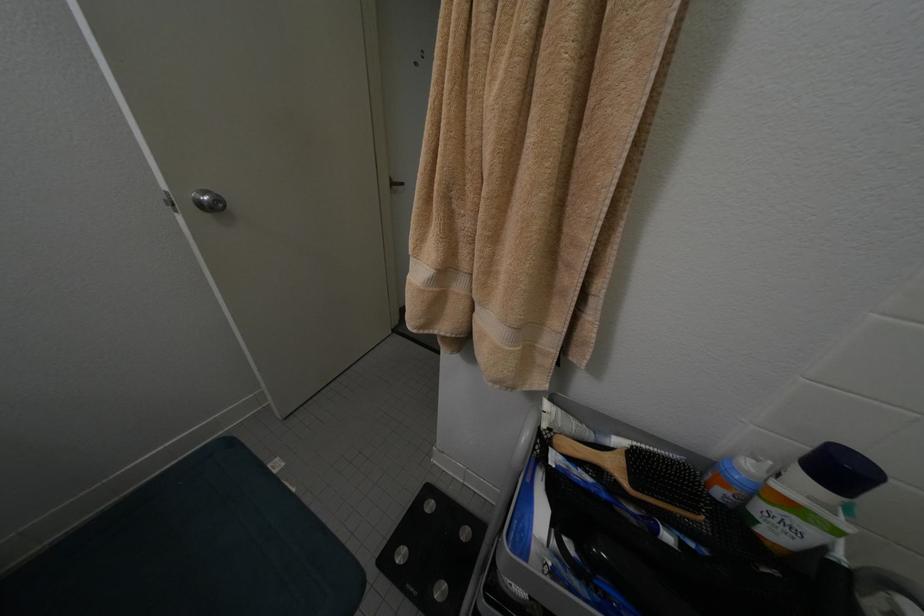
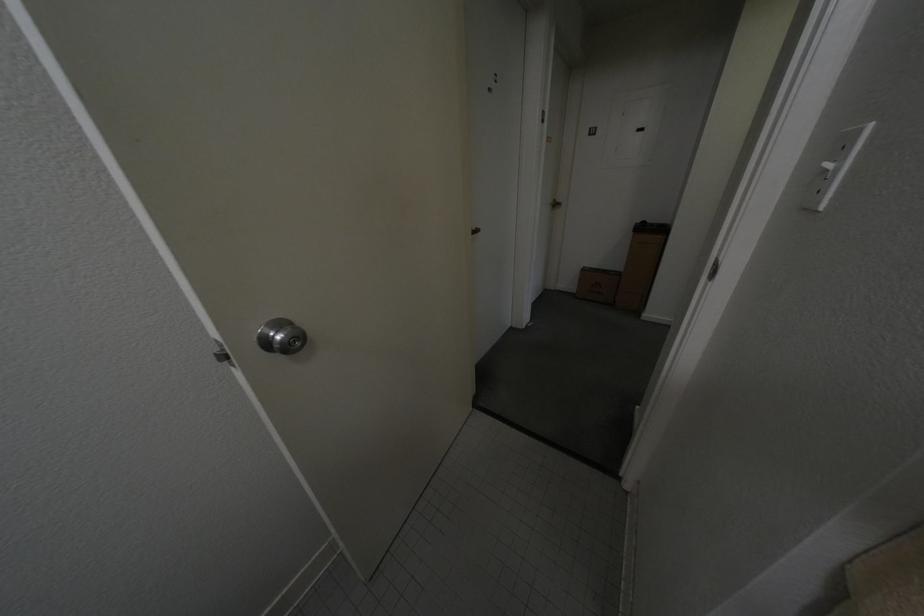
Consider the image. The images are taken continuously from a first-person perspective. In which direction are you moving?

The movement direction of the cameraman is left, forward.